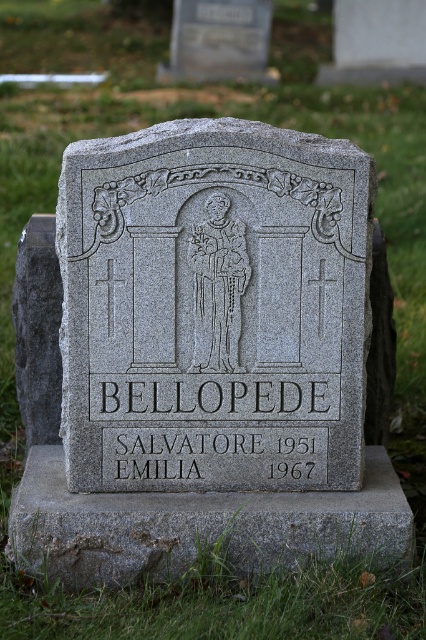
Question: Does gray granite gravestone at center appear under gray stone statue at center?

Choices:
 (A) yes
 (B) no

Answer: (A)

Question: Which object is closer to the camera taking this photo?

Choices:
 (A) gray stone statue at center
 (B) gray granite gravestone at center

Answer: (B)

Question: Can you confirm if gray granite gravestone at center is positioned below gray stone statue at center?

Choices:
 (A) no
 (B) yes

Answer: (B)

Question: Which object is farther from the camera taking this photo?

Choices:
 (A) gray stone statue at center
 (B) gray granite gravestone at center

Answer: (A)

Question: Among these objects, which one is farthest from the camera?

Choices:
 (A) gray granite gravestone at center
 (B) gray stone statue at center

Answer: (B)

Question: In this image, where is gray granite gravestone at center located relative to gray stone statue at center?

Choices:
 (A) above
 (B) below

Answer: (B)